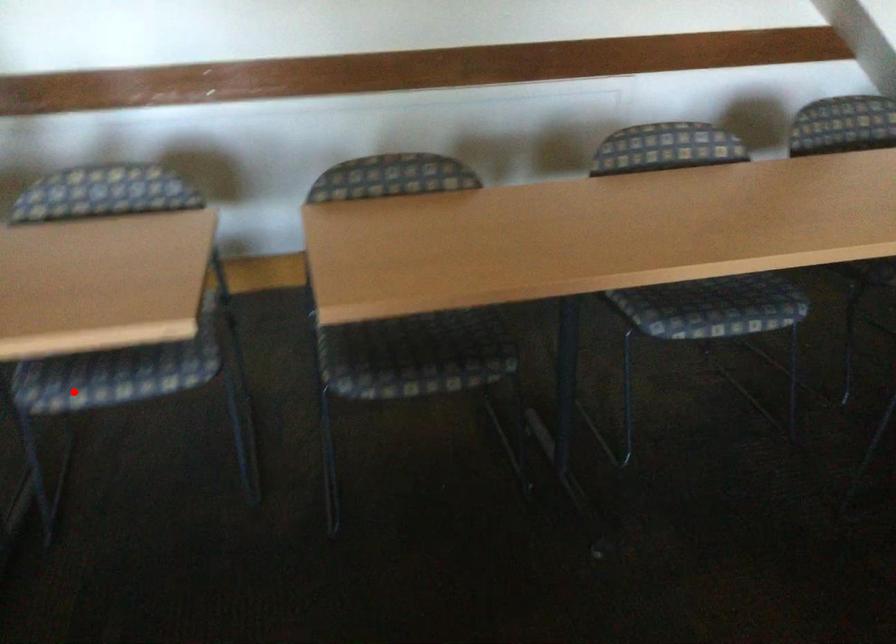
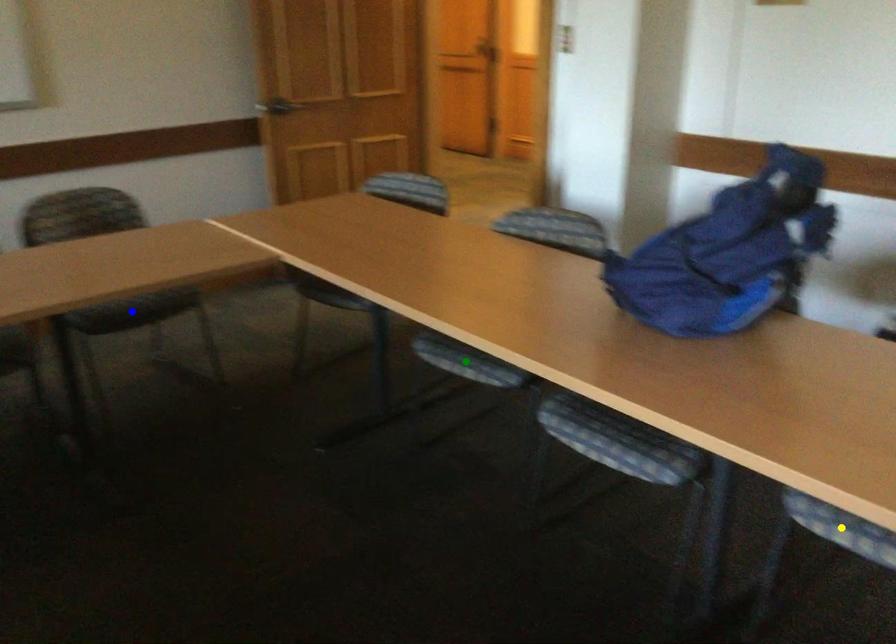
Question: I am providing you with two images of the same scene from different viewpoints. A red point is marked on the first image. You are given multiple points on the second image. Which spot in image 2 lines up with the point in image 1?

Choices:
 (A) blue point
 (B) green point
 (C) yellow point

Answer: (C)